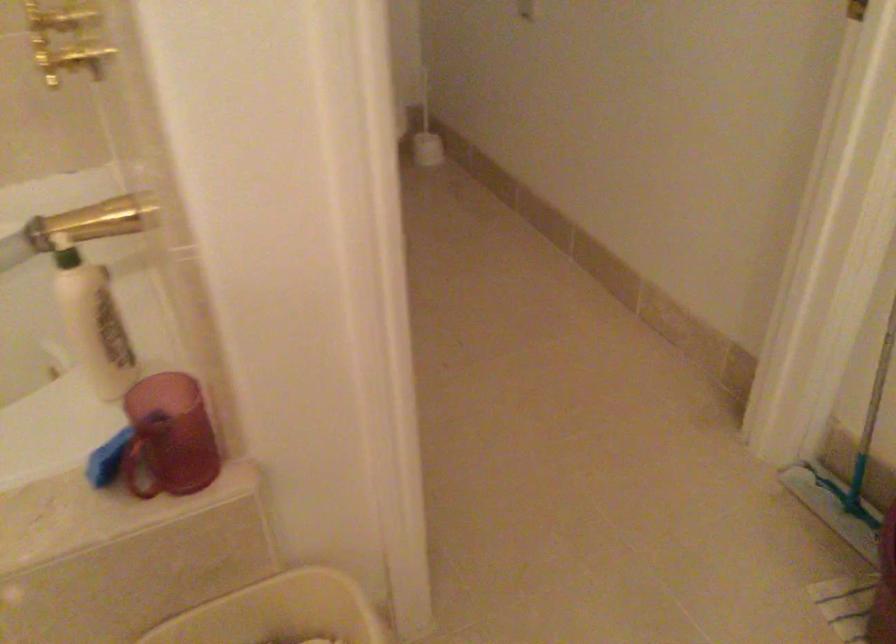
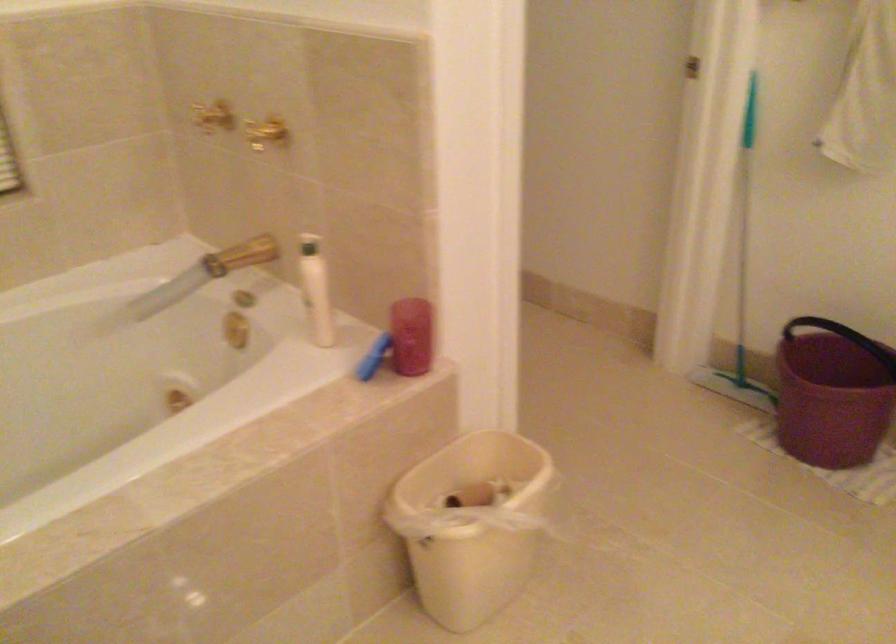
Question: I am providing you with two images of the same scene from different viewpoints. Please identify which objects are invisible in image2.

Choices:
 (A) toilet brush handle
 (B) white lotion bottle
 (C) fluffy white stool
 (D) long handled mop

Answer: (A)